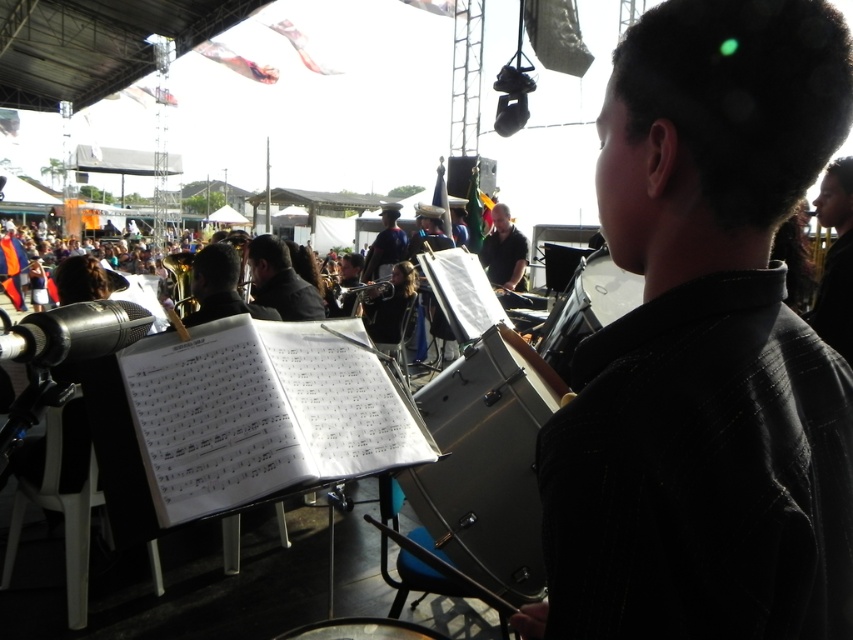
Between black textured shirt at center and dark gray uniform at center, which one has less height?

dark gray uniform at center

Between point (756, 448) and point (265, 257), which one is positioned behind?

Point (265, 257)

The width and height of the screenshot is (853, 640). Identify the location of black textured shirt at center. (705, 348).

Between point (495, 404) and point (281, 296), which one is positioned in front?

Point (495, 404)

Is point (422, 493) positioned in front of point (310, 308)?

Yes, point (422, 493) is closer to viewer.

I want to click on metallic drum at center, so click(x=486, y=464).

Does point (714, 113) lie in front of point (503, 243)?

Yes, it is.

Does black textured shirt at center have a smaller size compared to black matte shirt at center?

Correct, black textured shirt at center occupies less space than black matte shirt at center.

Locate an element on the screen. The width and height of the screenshot is (853, 640). black textured shirt at center is located at coordinates (705, 348).